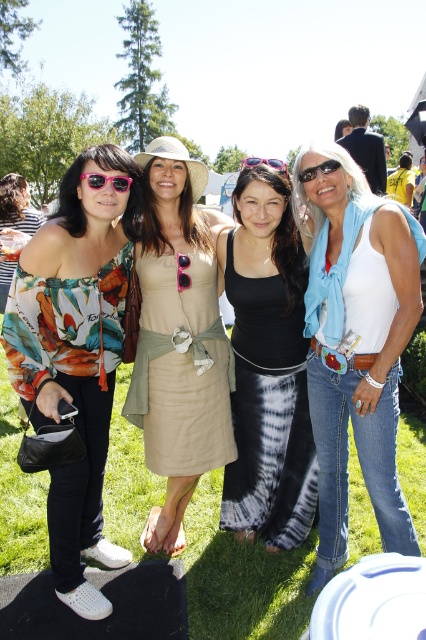
Which is in front, point (350, 292) or point (287, 289)?

Positioned in front is point (350, 292).

Looking at this image, is white cotton tank top at center bigger than black tie-dye skirt at center?

Yes, white cotton tank top at center is bigger than black tie-dye skirt at center.

Does point (319, 161) lie behind point (264, 253)?

No, it is not.

You are a GUI agent. You are given a task and a screenshot of the screen. Output one action in this format:
    pyautogui.click(x=<x>, y=<y>)
    Task: Click on the white cotton tank top at center
    
    Given the screenshot: What is the action you would take?
    pyautogui.click(x=356, y=344)

From the picture: Does black tie-dye skirt at center have a greater width compared to matte black sunglasses at center?

No.

Is point (224, 476) farther from viewer compared to point (253, 164)?

Yes, it is behind point (253, 164).

The width and height of the screenshot is (426, 640). I want to click on black tie-dye skirt at center, so click(x=267, y=369).

Between white cotton tank top at center and matte black sunglasses at center, which one has less height?

matte black sunglasses at center is shorter.

Is the position of white cotton tank top at center less distant than that of matte black sunglasses at center?

Yes, white cotton tank top at center is closer to the viewer.

Locate an element on the screen. The image size is (426, 640). white cotton tank top at center is located at coordinates (356, 344).